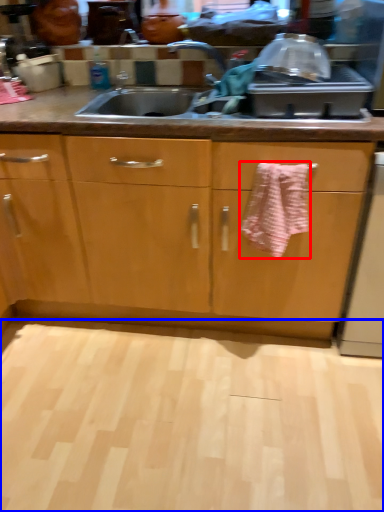
Question: Among these objects, which one is nearest to the camera, bath towel (highlighted by a red box) or plain (highlighted by a blue box)?

Choices:
 (A) bath towel
 (B) plain

Answer: (B)